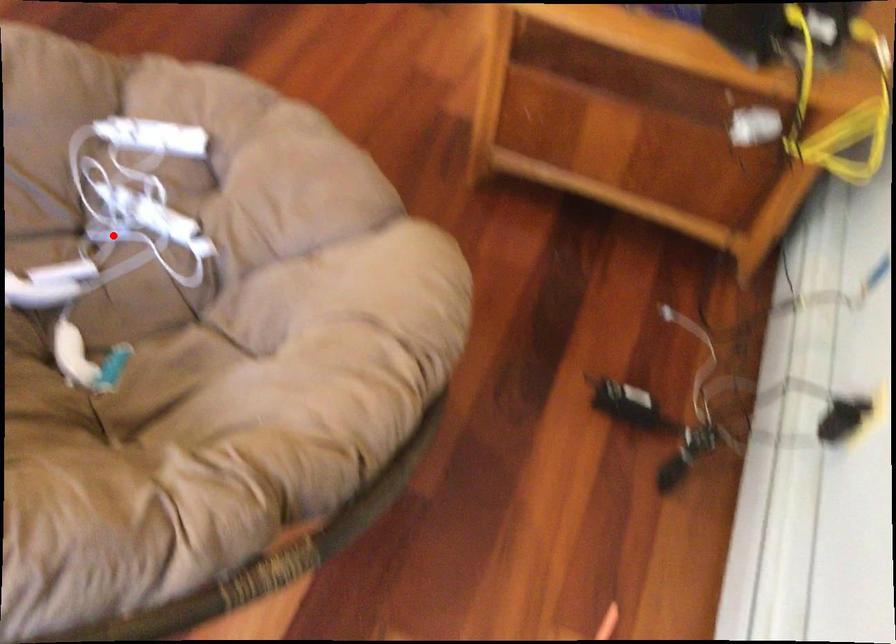
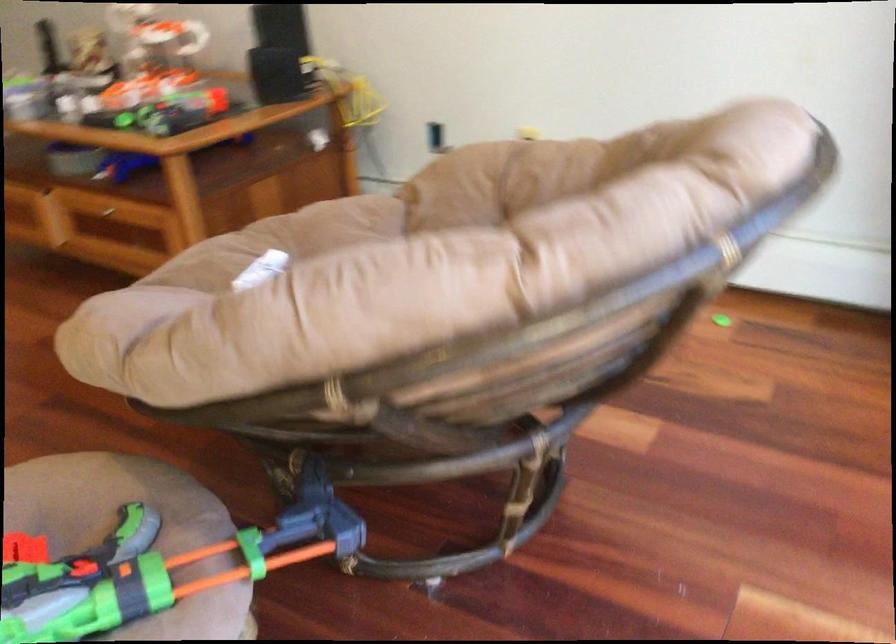
Question: I am providing you with two images of the same scene from different viewpoints. A red point is marked on the first image. At the location where the point appears in image 1, is it still visible in image 2?

Choices:
 (A) Yes
 (B) No

Answer: (B)